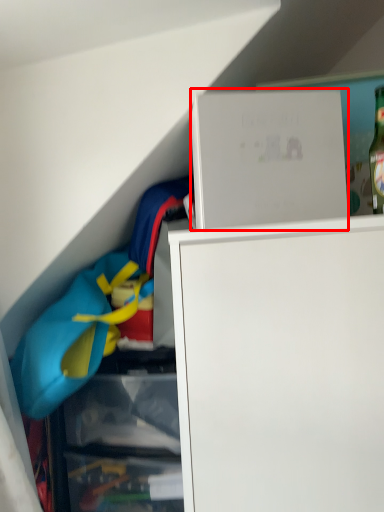
Question: From the image's perspective, where is cabinet (annotated by the red box) located relative to clothing?

Choices:
 (A) above
 (B) below

Answer: (A)